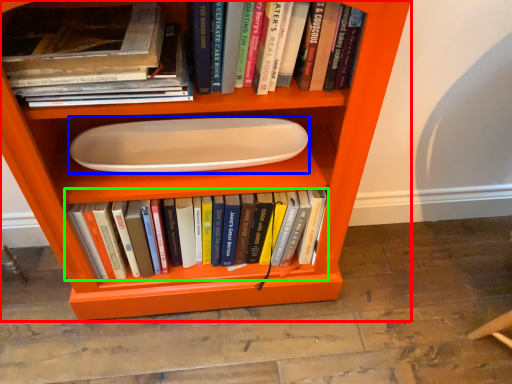
Question: Considering the real-world distances, which object is closest to shelf (highlighted by a red box)? paper plate (highlighted by a blue box) or book (highlighted by a green box).

Choices:
 (A) paper plate
 (B) book

Answer: (B)